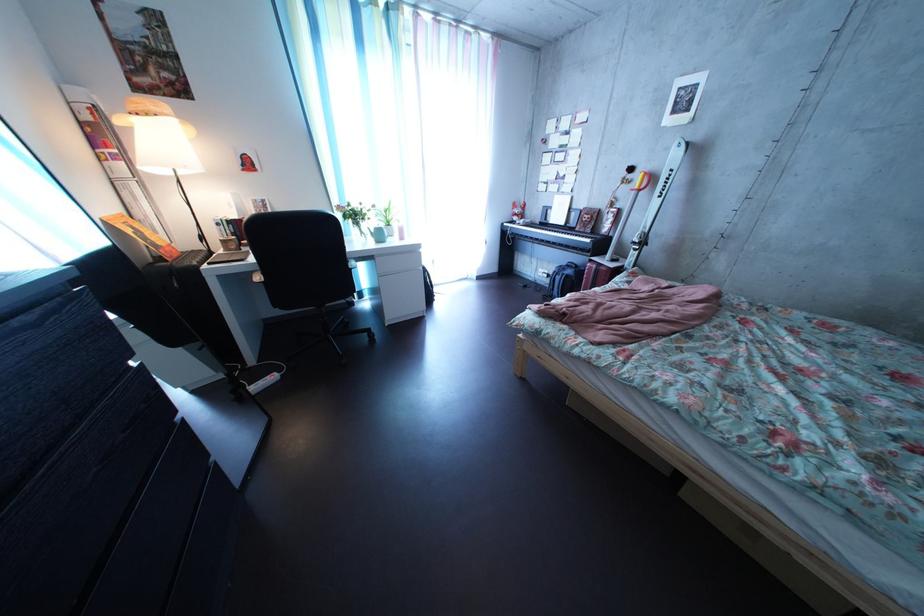
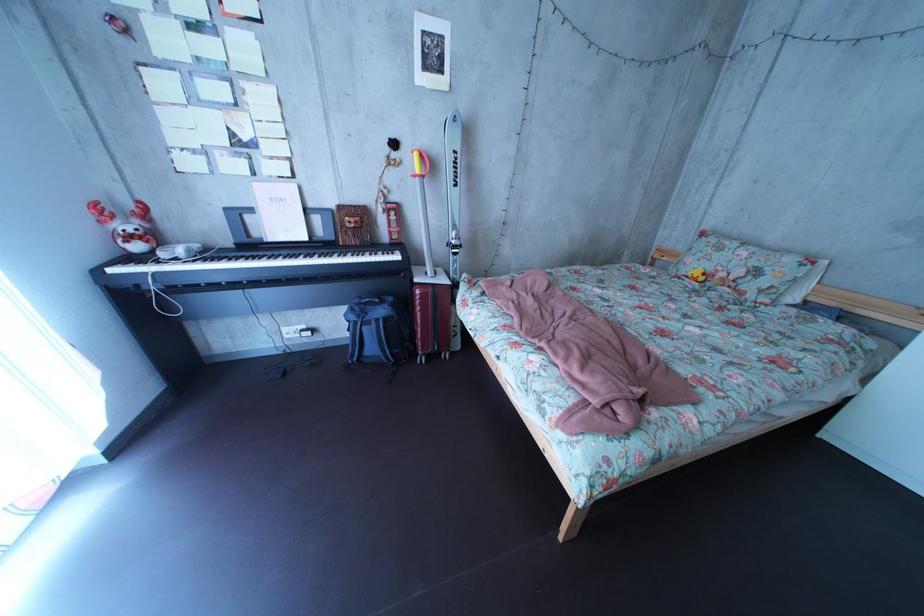
Where in the second image is the point corresponding to (x=544, y=233) from the first image?

(225, 262)